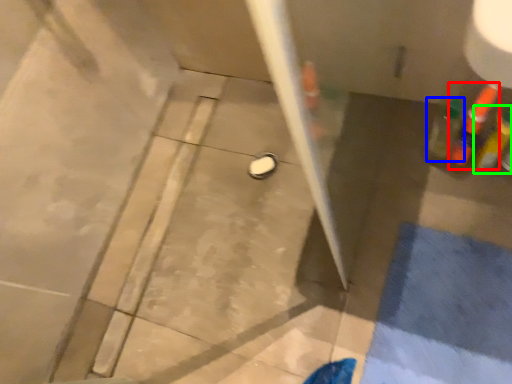
Question: Estimate the real-world distances between objects in this image. Which object is farther from bottle (highlighted by a red box), bottle (highlighted by a blue box) or bottle (highlighted by a green box)?

Choices:
 (A) bottle
 (B) bottle

Answer: (A)